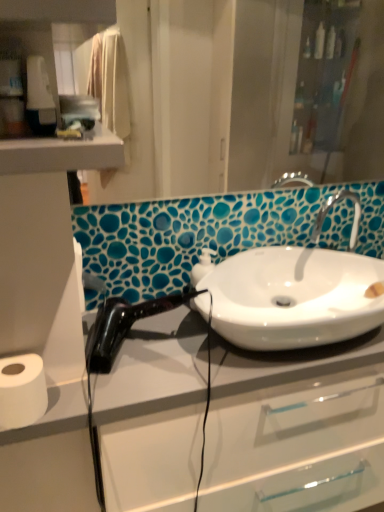
Where is `free spot behind white matte toilet paper at lower left`? The width and height of the screenshot is (384, 512). free spot behind white matte toilet paper at lower left is located at coordinates (95, 359).